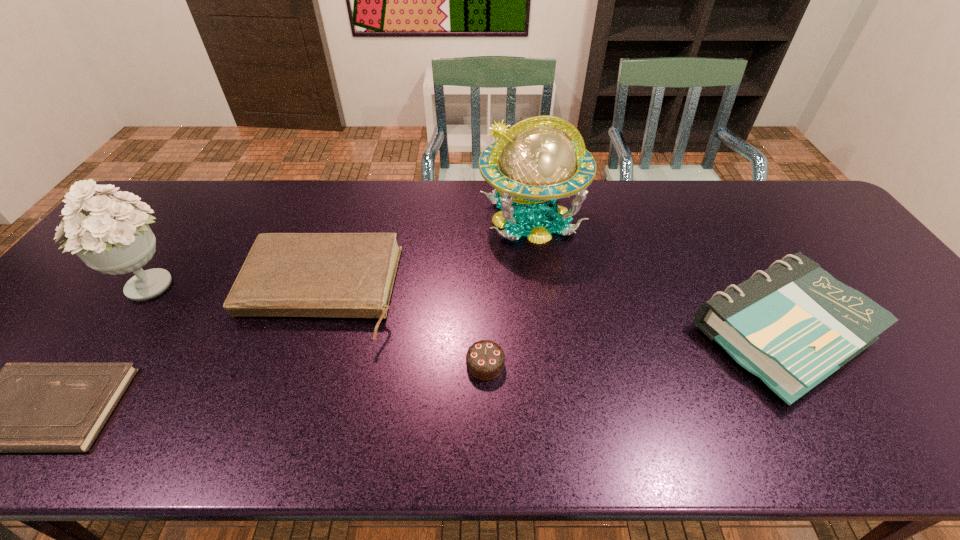
Image resolution: width=960 pixels, height=540 pixels. I want to click on vacant space in between the second paperback book from left to right and the rightmost object, so click(550, 313).

I want to click on vacant region between the bouquet and the tallest paperback book, so click(x=465, y=309).

Where is `vacant space in between the fourth shortest object and the chocolate cake`? This screenshot has width=960, height=540. vacant space in between the fourth shortest object and the chocolate cake is located at coordinates (633, 349).

Select which object appears as the third closest to the globe. Please provide its 2D coordinates. Your answer should be formatted as a tuple, i.e. [(x, y)], where the tuple contains the x and y coordinates of a point satisfying the conditions above.

[(485, 359)]

What are the coordinates of `object that is the closest to the globe` in the screenshot? It's located at (792, 325).

Choose which paperback book is the nearest neighbor to the globe. Please provide its 2D coordinates. Your answer should be formatted as a tuple, i.e. [(x, y)], where the tuple contains the x and y coordinates of a point satisfying the conditions above.

[(792, 325)]

Identify which paperback book is located as the nearest to the fourth shortest object. Please provide its 2D coordinates. Your answer should be formatted as a tuple, i.e. [(x, y)], where the tuple contains the x and y coordinates of a point satisfying the conditions above.

[(345, 275)]

Identify the location of vacant point that satisfies the following two spatial constraints: 1. on the back side of the bouquet; 2. on the left side of the globe. (197, 218).